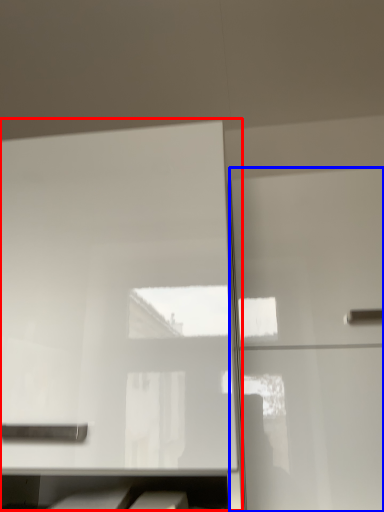
Question: Which object is further to the camera taking this photo, cabinetry (highlighted by a red box) or cabinetry (highlighted by a blue box)?

Choices:
 (A) cabinetry
 (B) cabinetry

Answer: (B)